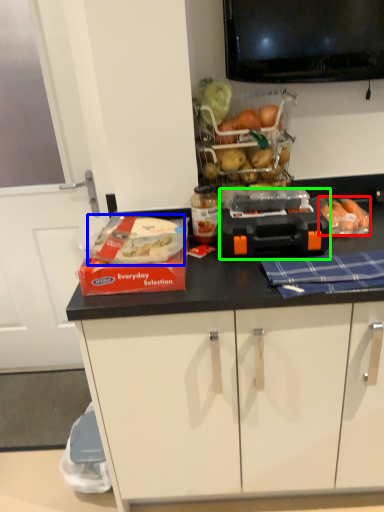
Question: Considering the real-world distances, which object is closest to food (highlighted by a red box)? food (highlighted by a blue box) or appliance (highlighted by a green box).

Choices:
 (A) food
 (B) appliance

Answer: (B)